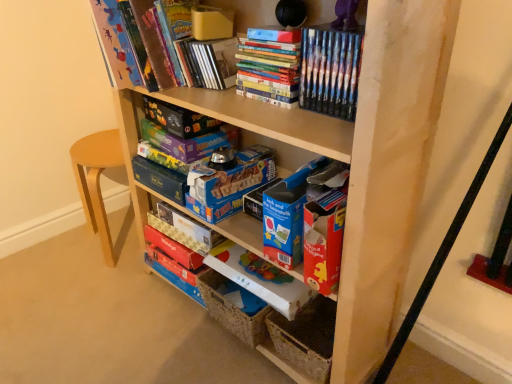
Question: Should I look upward or downward to see blue cardboard box at center, the third paperback book ordered from the bottom?

Choices:
 (A) down
 (B) up

Answer: (B)

Question: Is matte board game at upper center, acting as the second paperback book starting from the top, further to the viewer compared to matte purple board game at center, which is the third paperback book from top to bottom?

Choices:
 (A) no
 (B) yes

Answer: (A)

Question: Is matte board game at upper center, acting as the second paperback book starting from the top, closer to the viewer compared to matte purple board game at center, which is the third paperback book from top to bottom?

Choices:
 (A) no
 (B) yes

Answer: (B)

Question: From a real-world perspective, does matte board game at upper center, acting as the second paperback book starting from the top, sit lower than matte purple board game at center, positioned as the 5th paperback book in bottom-to-top order?

Choices:
 (A) yes
 (B) no

Answer: (B)

Question: Considering the relative sizes of matte board game at upper center, the 6th paperback book from the bottom, and matte purple board game at center, which is the third paperback book from top to bottom, in the image provided, is matte board game at upper center, the 6th paperback book from the bottom, wider than matte purple board game at center, which is the third paperback book from top to bottom,?

Choices:
 (A) no
 (B) yes

Answer: (B)

Question: Is matte purple board game at center, positioned as the 5th paperback book in bottom-to-top order, located within matte board game at upper center, the 6th paperback book from the bottom?

Choices:
 (A) yes
 (B) no

Answer: (B)

Question: Can you confirm if matte board game at upper center, the 6th paperback book from the bottom, is positioned to the left of matte purple board game at center, which is the third paperback book from top to bottom?

Choices:
 (A) no
 (B) yes

Answer: (B)

Question: Is blue cardboard storage box at lower center positioned before matte purple board game at center, positioned as the 5th paperback book in bottom-to-top order?

Choices:
 (A) yes
 (B) no

Answer: (A)

Question: Considering the relative sizes of blue cardboard storage box at lower center and matte purple board game at center, which is the third paperback book from top to bottom, in the image provided, is blue cardboard storage box at lower center shorter than matte purple board game at center, which is the third paperback book from top to bottom,?

Choices:
 (A) yes
 (B) no

Answer: (B)

Question: Considering the relative positions of blue cardboard storage box at lower center and matte purple board game at center, which is the third paperback book from top to bottom, in the image provided, is blue cardboard storage box at lower center to the left of matte purple board game at center, which is the third paperback book from top to bottom, from the viewer's perspective?

Choices:
 (A) yes
 (B) no

Answer: (B)

Question: Is blue cardboard storage box at lower center smaller than matte purple board game at center, positioned as the 5th paperback book in bottom-to-top order?

Choices:
 (A) yes
 (B) no

Answer: (B)

Question: Is blue cardboard storage box at lower center bigger than matte purple board game at center, which is the third paperback book from top to bottom?

Choices:
 (A) yes
 (B) no

Answer: (A)

Question: Considering the relative sizes of blue cardboard storage box at lower center and matte purple board game at center, which is the third paperback book from top to bottom, in the image provided, is blue cardboard storage box at lower center thinner than matte purple board game at center, which is the third paperback book from top to bottom,?

Choices:
 (A) yes
 (B) no

Answer: (B)

Question: From a real-world perspective, is matte cardboard book at center, the 2th paperback book in the bottom-to-top sequence, physically above blue cardboard storage box at lower center?

Choices:
 (A) yes
 (B) no

Answer: (A)